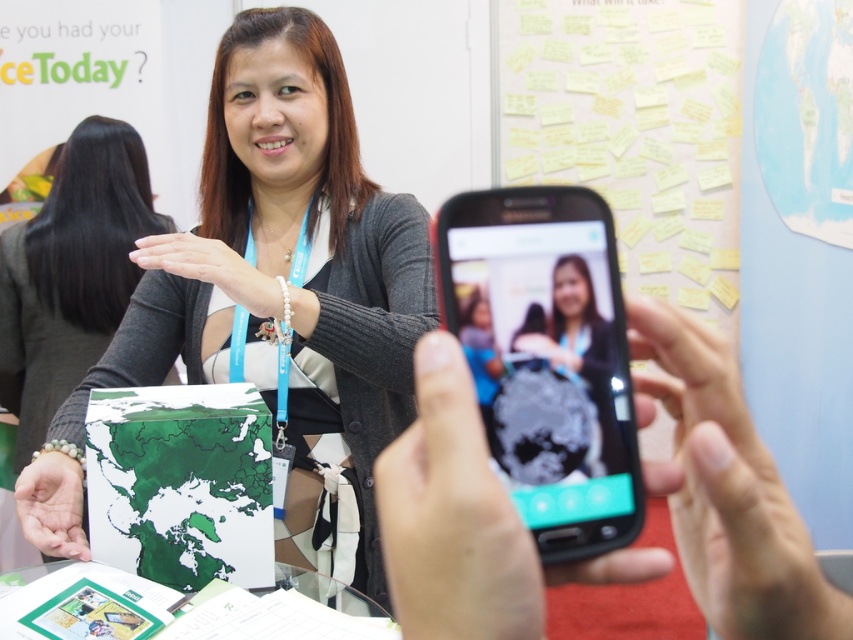
Question: Which object is the closest to the smooth skin hand at center?

Choices:
 (A) green matte map at center
 (B) green paper at lower center
 (C) green matte map at lower left
 (D) pearl bracelet at center

Answer: (B)

Question: Observing the image, what is the correct spatial positioning of matte green map at center in reference to green matte map at center?

Choices:
 (A) left
 (B) right

Answer: (B)

Question: Is black matte phone at center thinner than green matte map at lower left?

Choices:
 (A) no
 (B) yes

Answer: (A)

Question: Can you confirm if smooth skin hand at center is bigger than green matte map at center?

Choices:
 (A) yes
 (B) no

Answer: (B)

Question: Which of the following is the farthest from the observer?

Choices:
 (A) smooth skin hand at center
 (B) green matte map at lower left

Answer: (B)

Question: Which object is closer to the camera taking this photo?

Choices:
 (A) matte green map at center
 (B) smooth skin hand at center
 (C) green matte map at lower left
 (D) green paper at lower center

Answer: (B)